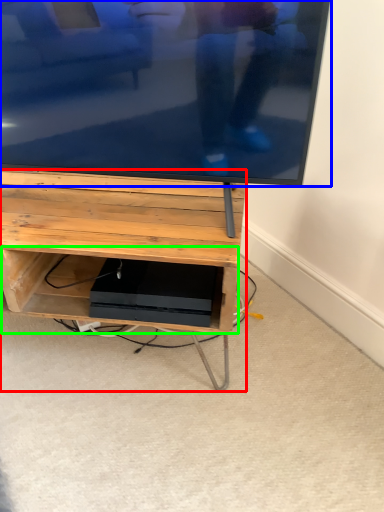
Question: Which is farther away from furniture (highlighted by a red box)? television (highlighted by a blue box) or shelf (highlighted by a green box)?

Choices:
 (A) television
 (B) shelf

Answer: (A)